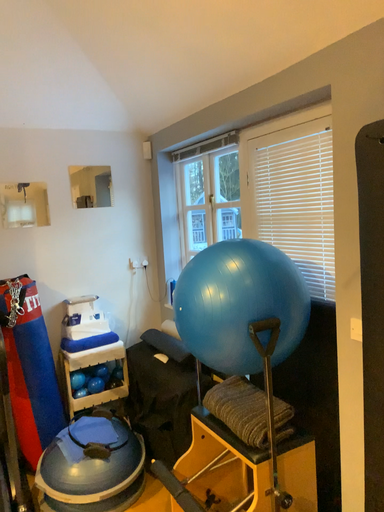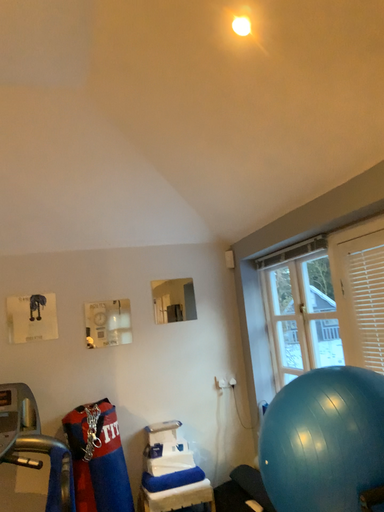
Question: How did the camera likely rotate when shooting the video?

Choices:
 (A) rotated right
 (B) rotated left

Answer: (B)